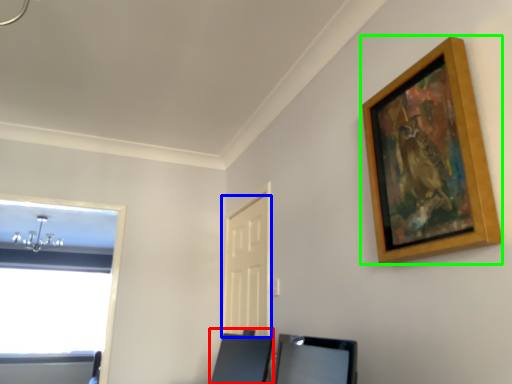
Question: Estimate the real-world distances between objects in this image. Which object is closer to vanity (highlighted by a red box), door (highlighted by a blue box) or picture frame (highlighted by a green box)?

Choices:
 (A) door
 (B) picture frame

Answer: (A)